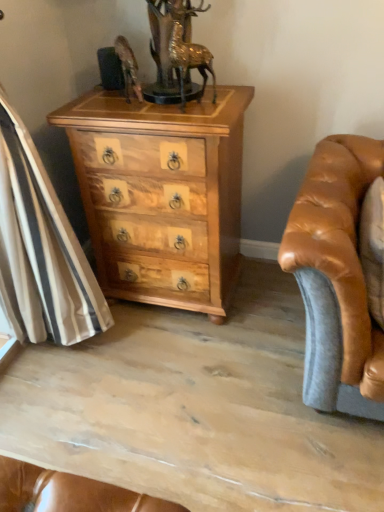
Measure the distance between gold metallic deer at upper center and camera.

The distance of gold metallic deer at upper center from camera is 1.35 meters.

This screenshot has width=384, height=512. What do you see at coordinates (176, 52) in the screenshot?
I see `gold metallic deer at upper center` at bounding box center [176, 52].

Where is `gold metallic deer at upper center`? The width and height of the screenshot is (384, 512). gold metallic deer at upper center is located at coordinates (176, 52).

What do you see at coordinates (161, 194) in the screenshot? This screenshot has height=512, width=384. I see `natural wood chest of drawers at center` at bounding box center [161, 194].

The height and width of the screenshot is (512, 384). What are the coordinates of `natural wood chest of drawers at center` in the screenshot? It's located at (161, 194).

You are a GUI agent. You are given a task and a screenshot of the screen. Output one action in this format:
    pyautogui.click(x=<x>, y=<y>)
    Task: Click on the gold metallic deer at upper center
    The width and height of the screenshot is (384, 512).
    Given the screenshot: What is the action you would take?
    pyautogui.click(x=176, y=52)

Would you say natural wood chest of drawers at center is to the left or to the right of gold metallic deer at upper center in the picture?

In the image, natural wood chest of drawers at center appears on the left side of gold metallic deer at upper center.

Does natural wood chest of drawers at center lie in front of gold metallic deer at upper center?

No, it is behind gold metallic deer at upper center.

Considering the points (216, 110) and (192, 92), which point is behind, point (216, 110) or point (192, 92)?

Point (192, 92)

From the image's perspective, is natural wood chest of drawers at center under gold metallic deer at upper center?

Correct, natural wood chest of drawers at center appears lower than gold metallic deer at upper center in the image.

From a real-world perspective, between natural wood chest of drawers at center and gold metallic deer at upper center, who is vertically lower?

From a 3D spatial view, natural wood chest of drawers at center is below.

Considering the sizes of objects natural wood chest of drawers at center and gold metallic deer at upper center in the image provided, who is thinner, natural wood chest of drawers at center or gold metallic deer at upper center?

With smaller width is gold metallic deer at upper center.

Between natural wood chest of drawers at center and gold metallic deer at upper center, which one has less height?

gold metallic deer at upper center.

Consider the image. Is natural wood chest of drawers at center smaller than gold metallic deer at upper center?

No, natural wood chest of drawers at center is not smaller than gold metallic deer at upper center.

Choose the correct answer: Is natural wood chest of drawers at center inside gold metallic deer at upper center or outside it?

natural wood chest of drawers at center exists outside the volume of gold metallic deer at upper center.

Are natural wood chest of drawers at center and gold metallic deer at upper center located far from each other?

No, there isn't a large distance between natural wood chest of drawers at center and gold metallic deer at upper center.

Is gold metallic deer at upper center at the back of natural wood chest of drawers at center?

No, natural wood chest of drawers at center is not facing away from gold metallic deer at upper center.

This screenshot has height=512, width=384. Identify the location of chest of drawers behind the gold metallic deer at upper center. point(161,194).

Does gold metallic deer at upper center appear on the left side of natural wood chest of drawers at center?

No, gold metallic deer at upper center is not to the left of natural wood chest of drawers at center.

Between gold metallic deer at upper center and natural wood chest of drawers at center, which one is positioned behind?

natural wood chest of drawers at center is further away from the camera.

Which point is more distant from viewer, (177, 29) or (131, 159)?

Positioned behind is point (131, 159).

From the image's perspective, which object appears higher, gold metallic deer at upper center or natural wood chest of drawers at center?

gold metallic deer at upper center appears higher in the image.

From a real-world perspective, is gold metallic deer at upper center physically located above or below natural wood chest of drawers at center?

Clearly, from a real-world perspective, gold metallic deer at upper center is above natural wood chest of drawers at center.

Based on the photo, is gold metallic deer at upper center wider or thinner than natural wood chest of drawers at center?

gold metallic deer at upper center is thinner than natural wood chest of drawers at center.

Can you confirm if gold metallic deer at upper center is shorter than natural wood chest of drawers at center?

Yes, gold metallic deer at upper center is shorter than natural wood chest of drawers at center.

Based on their sizes in the image, would you say gold metallic deer at upper center is bigger or smaller than natural wood chest of drawers at center?

In the image, gold metallic deer at upper center appears to be smaller than natural wood chest of drawers at center.

Could natural wood chest of drawers at center be considered to be inside gold metallic deer at upper center?

No, natural wood chest of drawers at center is not inside gold metallic deer at upper center.

Would you consider gold metallic deer at upper center to be distant from natural wood chest of drawers at center?

gold metallic deer at upper center is actually quite close to natural wood chest of drawers at center.

Is gold metallic deer at upper center aimed at natural wood chest of drawers at center?

No.

Locate an element on the screen. antique above the natural wood chest of drawers at center (from the image's perspective) is located at coordinates (176, 52).

Where is `the chest of drawers behind the gold metallic deer at upper center`? the chest of drawers behind the gold metallic deer at upper center is located at coordinates (161, 194).

Where is `antique that is above the natural wood chest of drawers at center (from a real-world perspective)`? The image size is (384, 512). antique that is above the natural wood chest of drawers at center (from a real-world perspective) is located at coordinates (176, 52).